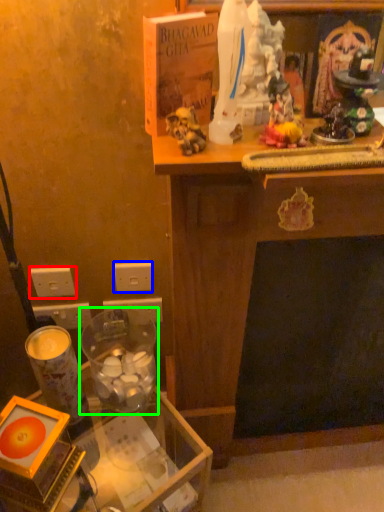
Question: Which is farther away from electric outlet (highlighted by a red box)? electric outlet (highlighted by a blue box) or candle holder (highlighted by a green box)?

Choices:
 (A) electric outlet
 (B) candle holder

Answer: (B)